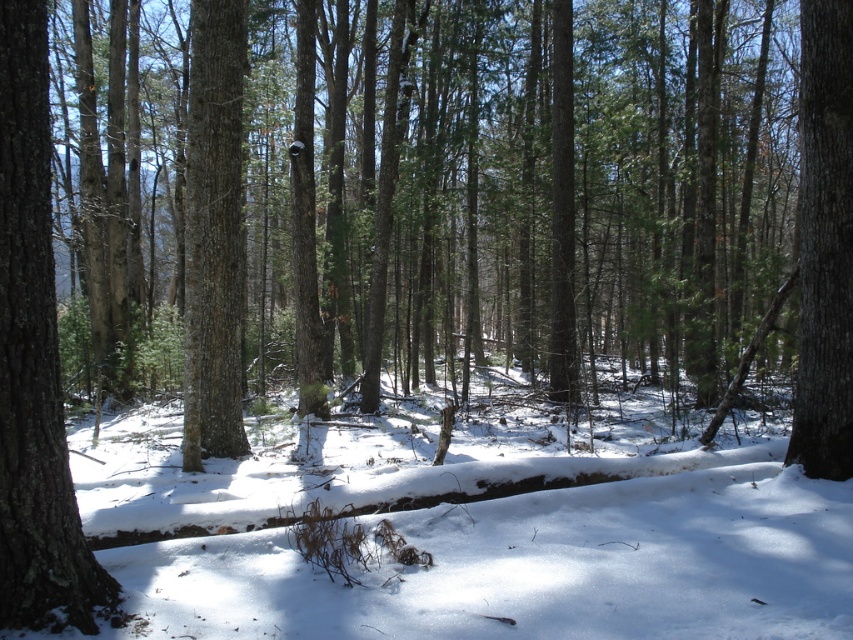
You are a hiker who wants to walk from the left side of the image to the right side. You see the white powdery snow at center and the smooth brown tree trunk at right. Which direction should you head towards to avoid the tree trunk?

You should head towards the left of the smooth brown tree trunk at right because the white powdery snow at center is located to the left of it, providing a clear path away from the tree trunk.

You are standing in the winter forest scene. There is a smooth bark tree at left represented by the point (33, 362). Can you see the smooth bark tree at left from your current position?

Yes, the smooth bark tree at left is represented by the point (33, 362), so you can see it from your current position in the winter forest scene.

You are an animal looking for shelter in the winter forest. You see the white powdery snow at center and the smooth brown tree trunk at right. Which location would provide better insulation against the cold wind?

The white powdery snow at center would provide better insulation against the cold wind because it is not as tall as the smooth brown tree trunk at right, making it less exposed to the wind.